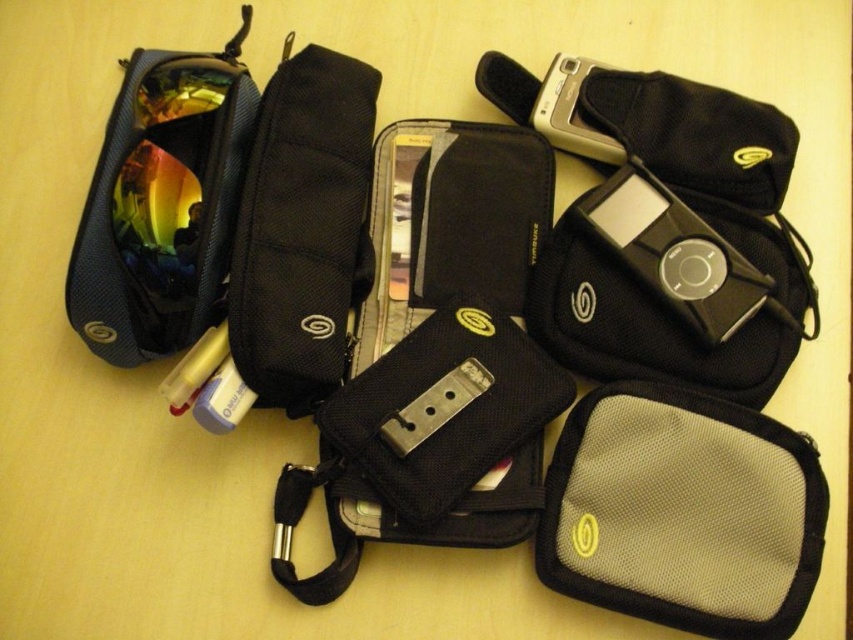
Question: Which is farther from the gray mesh pouch at lower right?

Choices:
 (A) silver metallic camera at upper right
 (B) satin black ipod at center right

Answer: (A)

Question: Among these points, which one is nearest to the camera?

Choices:
 (A) (234, 326)
 (B) (566, 150)
 (C) (556, 468)

Answer: (A)

Question: Is matte black pouch at upper left wider than satin black ipod at center right?

Choices:
 (A) no
 (B) yes

Answer: (A)

Question: Can you confirm if matte black pouch at upper left is positioned above silver metallic camera at upper right?

Choices:
 (A) no
 (B) yes

Answer: (A)

Question: Is gray mesh pouch at lower right to the right of matte black pouch at upper left from the viewer's perspective?

Choices:
 (A) no
 (B) yes

Answer: (B)

Question: Which point appears farthest from the camera in this image?

Choices:
 (A) (683, 273)
 (B) (602, 138)
 (C) (695, 500)
 (D) (230, 106)

Answer: (B)